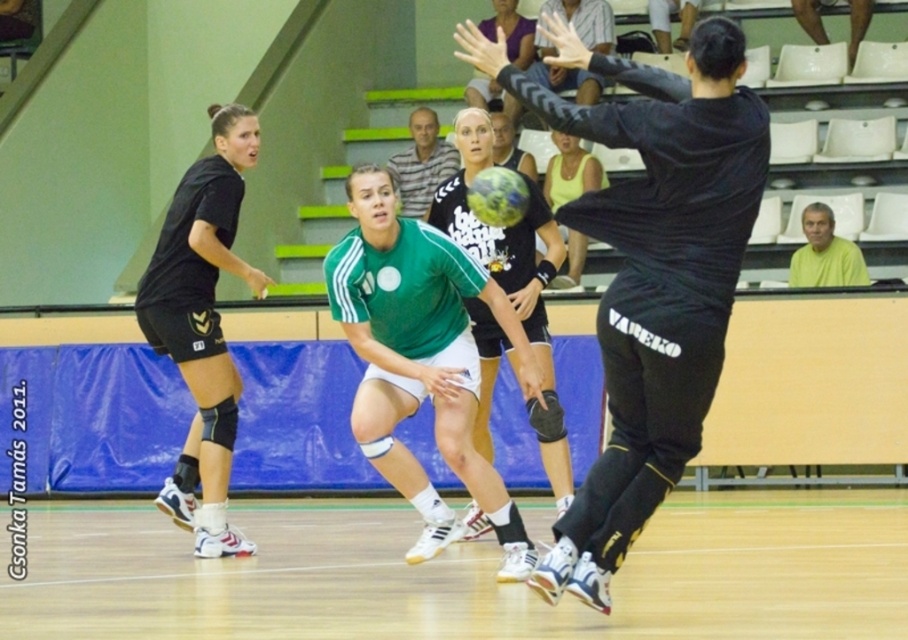
Measure the distance from gray striped shirt at center to yellow matte shirt at upper right.

A distance of 6.17 meters exists between gray striped shirt at center and yellow matte shirt at upper right.

I want to click on gray striped shirt at center, so click(x=422, y=163).

From the picture: Who is higher up, black matte jersey at center or black matte shorts at left?

Positioned higher is black matte jersey at center.

Between black matte jersey at center and black matte shorts at left, which one has less height?

black matte jersey at center

Image resolution: width=908 pixels, height=640 pixels. What do you see at coordinates (650, 273) in the screenshot?
I see `black matte jersey at center` at bounding box center [650, 273].

The width and height of the screenshot is (908, 640). What are the coordinates of `black matte jersey at center` in the screenshot? It's located at (650, 273).

Based on the photo, is black matte jersey at center closer to the viewer compared to yellow matte shirt at upper right?

Yes.

Where is `black matte jersey at center`? This screenshot has height=640, width=908. black matte jersey at center is located at coordinates (650, 273).